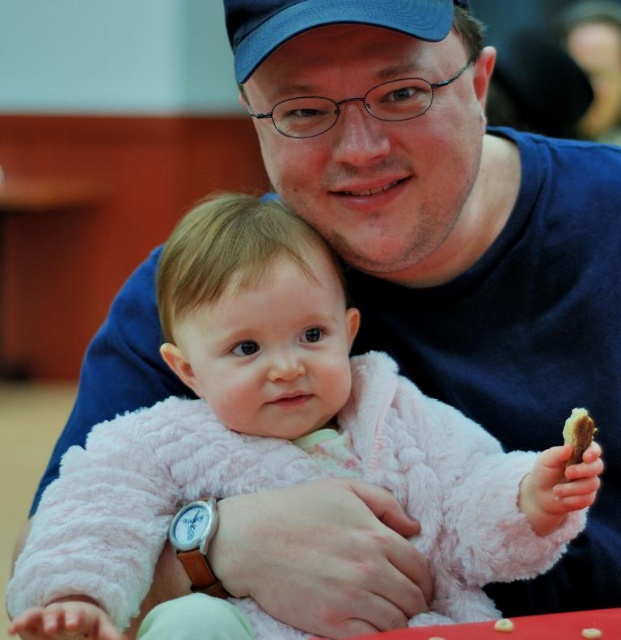
You are a photographer setting up for a family photo. You notice the blue fabric baseball cap at upper center and the brown crumbly cookie at lower right in the frame. Which object should you adjust to ensure both fit well in the composition without overlapping?

Since the blue fabric baseball cap at upper center is bigger than the brown crumbly cookie at lower right, you should adjust the position of the blue fabric baseball cap at upper center to prevent overlapping and maintain balance in the composition.

You are a photographer trying to capture the baby in the pink fluffy sweater at center. The blue fabric baseball cap at upper center is blocking your view. Can you adjust your position to see the baby without moving the objects? Explain why or why not.

The pink fluffy sweater at center is much taller than the blue fabric baseball cap at upper center. Since the sweater is taller, it would likely block the view of the baby more than the cap. However, the cap is at upper center, so moving your camera angle downward might allow you to see the baby while avoiding the cap, but the sweater could still obstruct the view depending on its exact position.

You are a photographer setting up for a closeup shot of the pink fluffy sweater at center and the blue fabric baseball cap at upper center. The camera you are using has a minimum focusing distance of 35 centimeters. Do you need to move closer or farther away to ensure both items are in focus?

The pink fluffy sweater at center and blue fabric baseball cap at upper center are 37.35 centimeters apart. Since the camera requires a minimum focusing distance of 35 centimeters, you need to move slightly farther away to ensure both items are within the focus range.